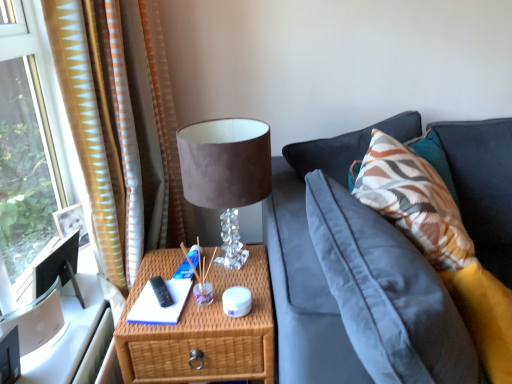
Question: From a real-world perspective, is suede-like brown table lamp at upper center below woven wood nightstand at lower center?

Choices:
 (A) yes
 (B) no

Answer: (B)

Question: Is suede-like brown table lamp at upper center bigger than woven wood nightstand at lower center?

Choices:
 (A) yes
 (B) no

Answer: (B)

Question: Is suede-like brown table lamp at upper center to the left of woven wood nightstand at lower center from the viewer's perspective?

Choices:
 (A) no
 (B) yes

Answer: (A)

Question: Could you tell me if suede-like brown table lamp at upper center is facing woven wood nightstand at lower center?

Choices:
 (A) no
 (B) yes

Answer: (A)

Question: Does suede-like brown table lamp at upper center have a lesser height compared to woven wood nightstand at lower center?

Choices:
 (A) no
 (B) yes

Answer: (B)

Question: Considering their positions, is suede-like brown table lamp at upper center located in front of or behind woven wood nightstand at lower center?

Choices:
 (A) front
 (B) behind

Answer: (A)

Question: In terms of width, does suede-like brown table lamp at upper center look wider or thinner when compared to woven wood nightstand at lower center?

Choices:
 (A) wide
 (B) thin

Answer: (B)

Question: From a real-world perspective, is suede-like brown table lamp at upper center physically located above or below woven wood nightstand at lower center?

Choices:
 (A) below
 (B) above

Answer: (B)

Question: Based on their positions, is suede-like brown table lamp at upper center located to the left or right of woven wood nightstand at lower center?

Choices:
 (A) right
 (B) left

Answer: (A)

Question: Which is correct: patterned fabric pillow at right is inside white paper at center, or outside of it?

Choices:
 (A) outside
 (B) inside

Answer: (A)

Question: From a real-world perspective, is patterned fabric pillow at right positioned above or below white paper at center?

Choices:
 (A) above
 (B) below

Answer: (A)

Question: Does point (413, 148) appear closer or farther from the camera than point (151, 304)?

Choices:
 (A) farther
 (B) closer

Answer: (A)

Question: Considering the positions of patterned fabric pillow at right and white paper at center in the image, is patterned fabric pillow at right bigger or smaller than white paper at center?

Choices:
 (A) small
 (B) big

Answer: (B)

Question: Looking at their shapes, would you say patterned fabric pillow at right is wider or thinner than woven wood nightstand at lower center?

Choices:
 (A) thin
 (B) wide

Answer: (A)

Question: In terms of size, does patterned fabric pillow at right appear bigger or smaller than woven wood nightstand at lower center?

Choices:
 (A) big
 (B) small

Answer: (B)